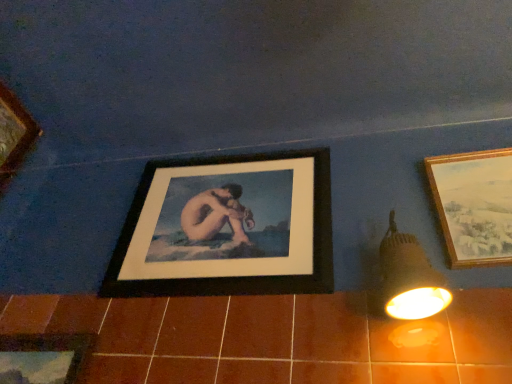
Question: Should I look upward or downward to see wooden framed landscape painting at right, which appears as the 3th picture frame when viewed from the left?

Choices:
 (A) down
 (B) up

Answer: (A)

Question: From the image's perspective, does brown ceramic tile at lower center appear higher than matte black light fixture at right?

Choices:
 (A) yes
 (B) no

Answer: (B)

Question: Is brown ceramic tile at lower center to the right of matte black light fixture at right from the viewer's perspective?

Choices:
 (A) no
 (B) yes

Answer: (A)

Question: Is brown ceramic tile at lower center positioned with its back to matte black light fixture at right?

Choices:
 (A) yes
 (B) no

Answer: (B)

Question: Can you confirm if brown ceramic tile at lower center is thinner than matte black light fixture at right?

Choices:
 (A) yes
 (B) no

Answer: (A)

Question: Does brown ceramic tile at lower center come in front of matte black light fixture at right?

Choices:
 (A) no
 (B) yes

Answer: (B)

Question: Does brown ceramic tile at lower center have a lesser height compared to matte black light fixture at right?

Choices:
 (A) yes
 (B) no

Answer: (A)

Question: From the image's perspective, does brown ceramic tile at lower center appear lower than black matte picture frame at center, marked as the second picture frame in a right-to-left arrangement?

Choices:
 (A) yes
 (B) no

Answer: (A)

Question: Is brown ceramic tile at lower center positioned with its back to black matte picture frame at center, the 2th picture frame viewed from the left?

Choices:
 (A) no
 (B) yes

Answer: (A)

Question: Can you confirm if brown ceramic tile at lower center is thinner than black matte picture frame at center, the 2th picture frame viewed from the left?

Choices:
 (A) no
 (B) yes

Answer: (B)

Question: From a real-world perspective, is brown ceramic tile at lower center on top of black matte picture frame at center, the 2th picture frame viewed from the left?

Choices:
 (A) yes
 (B) no

Answer: (B)

Question: Does brown ceramic tile at lower center touch black matte picture frame at center, marked as the second picture frame in a right-to-left arrangement?

Choices:
 (A) no
 (B) yes

Answer: (A)

Question: Does brown ceramic tile at lower center have a greater height compared to black matte picture frame at center, marked as the second picture frame in a right-to-left arrangement?

Choices:
 (A) yes
 (B) no

Answer: (B)

Question: Is wooden picture frame at lower left, which is the 1th picture frame in left-to-right order, closer to the viewer compared to black matte picture frame at center, the 2th picture frame viewed from the left?

Choices:
 (A) no
 (B) yes

Answer: (B)